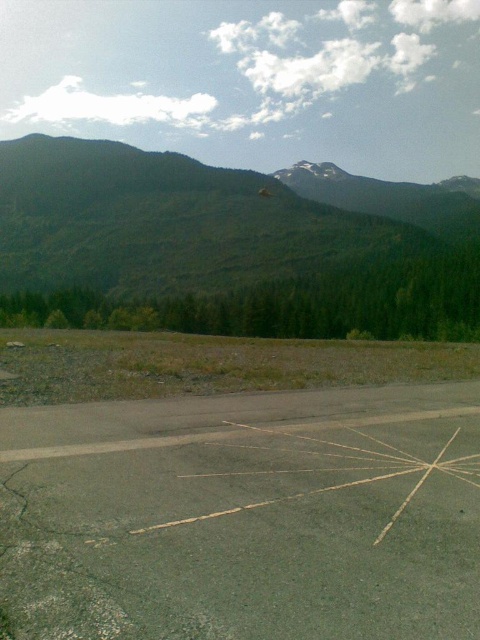
Question: Is gray asphalt parking lot at center positioned at the back of green forested mountain at upper left?

Choices:
 (A) yes
 (B) no

Answer: (B)

Question: Can you confirm if gray asphalt parking lot at center is bigger than green forested mountain at upper left?

Choices:
 (A) no
 (B) yes

Answer: (A)

Question: Is gray asphalt parking lot at center positioned at the back of green forested mountain at upper left?

Choices:
 (A) yes
 (B) no

Answer: (B)

Question: Which point is closer to the camera?

Choices:
 (A) gray asphalt parking lot at center
 (B) green forested mountain at upper left

Answer: (A)